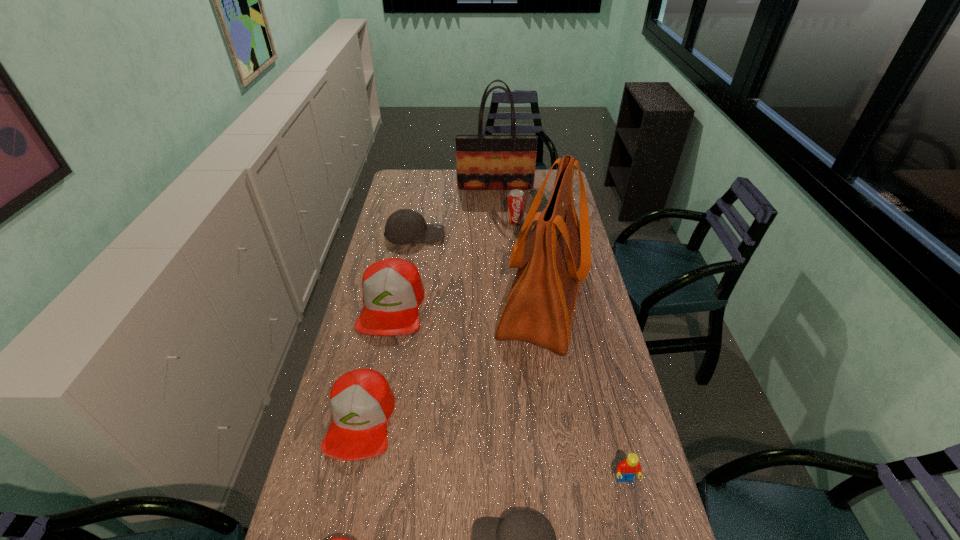
In order to click on the third nearest object in this screenshot , I will do `click(626, 470)`.

Locate an element on the screen. The width and height of the screenshot is (960, 540). free spot located 0.150m on the front-facing side of the farthest object is located at coordinates (496, 210).

The height and width of the screenshot is (540, 960). Identify the location of vacant space located on the left of the brown shopping bag. (414, 299).

Identify the location of free location located on the logo side of the soda can. This screenshot has height=540, width=960. (521, 285).

What are the coordinates of `vacant space positioned on the front-facing side of the biggest red baseball cap` in the screenshot? It's located at (378, 372).

The height and width of the screenshot is (540, 960). In order to click on vacant space situated 0.100m on the front brim of the bigger gray baseball cap in this screenshot , I will do `click(468, 234)`.

Identify the location of free space located on the front-facing side of the second nearest red baseball cap. The width and height of the screenshot is (960, 540). (343, 498).

You are a GUI agent. You are given a task and a screenshot of the screen. Output one action in this format:
    pyautogui.click(x=<x>, y=<y>)
    Task: Click on the vacant region located on the face of the Lego
    
    Given the screenshot: What is the action you would take?
    pyautogui.click(x=638, y=538)

Image resolution: width=960 pixels, height=540 pixels. I want to click on object that is positioned at the far edge, so click(484, 162).

Locate an element on the screen. The image size is (960, 540). shopping bag that is at the right edge is located at coordinates (556, 257).